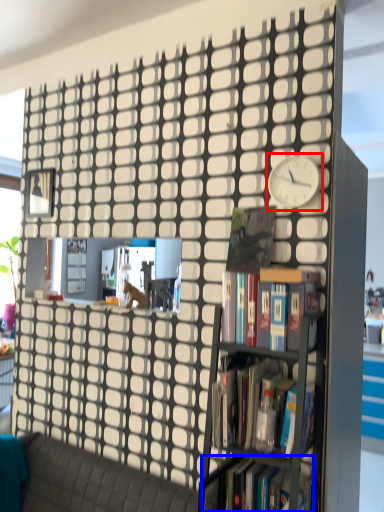
Question: Among these objects, which one is farthest to the camera, clock (highlighted by a red box) or book (highlighted by a blue box)?

Choices:
 (A) clock
 (B) book

Answer: (A)